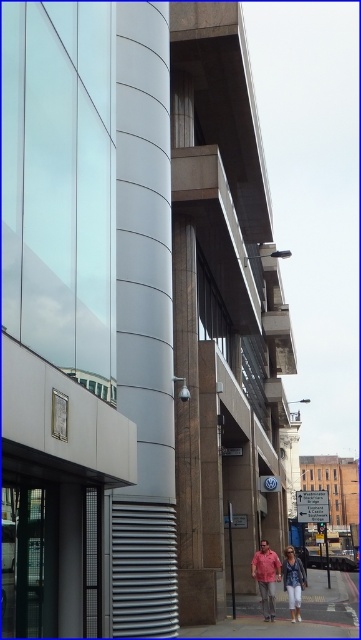
You are standing on the concrete sidewalk at lower center and see a person wearing a matte pink shirt at lower center. In which direction should you move to face away from the person?

The concrete sidewalk at lower center is to the right of matte pink shirt at lower center. To face away from the person, you should turn to your left.

You are standing on the concrete sidewalk at lower center and looking up. Is the denim jacket at lower center above or below you?

The denim jacket at lower center is above the concrete sidewalk at lower center, so the denim jacket at lower center is above you.

You are a tailor measuring clothes for a customer. You have a matte pink shirt at lower center and a denim jacket at lower center. Which garment has a smaller width?

The matte pink shirt at lower center has a smaller width than the denim jacket at lower center according to the description.